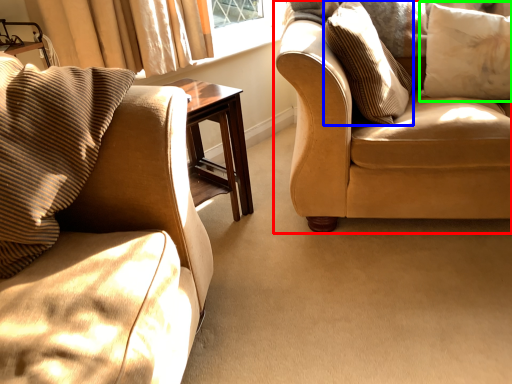
Question: Which is farther away from studio couch (highlighted by a red box)? pillow (highlighted by a blue box) or pillow (highlighted by a green box)?

Choices:
 (A) pillow
 (B) pillow

Answer: (B)